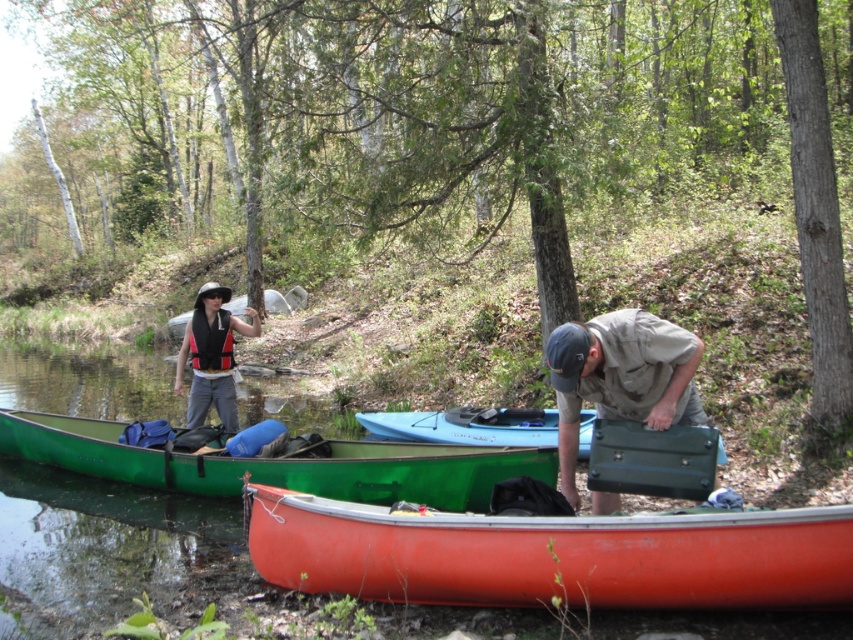
Question: Can you confirm if smooth orange canoe at lower center is smaller than matte black life vest at left?

Choices:
 (A) no
 (B) yes

Answer: (B)

Question: Which object is farther from the camera taking this photo?

Choices:
 (A) green matte briefcase at lower center
 (B) light blue plastic canoe at center
 (C) smooth orange canoe at lower center
 (D) green matte canoe at lower left

Answer: (B)

Question: Is smooth orange canoe at lower center bigger than green matte canoe at lower left?

Choices:
 (A) no
 (B) yes

Answer: (B)

Question: Can you confirm if green matte briefcase at lower center is smaller than light blue plastic canoe at center?

Choices:
 (A) yes
 (B) no

Answer: (B)

Question: Which object is closer to the camera taking this photo?

Choices:
 (A) green matte canoe at lower left
 (B) matte black life vest at left
 (C) smooth orange canoe at lower center

Answer: (C)

Question: Estimate the real-world distances between objects in this image. Which object is closer to the green matte canoe at lower left?

Choices:
 (A) smooth orange canoe at lower center
 (B) matte black life vest at left
 (C) green matte briefcase at lower center

Answer: (A)